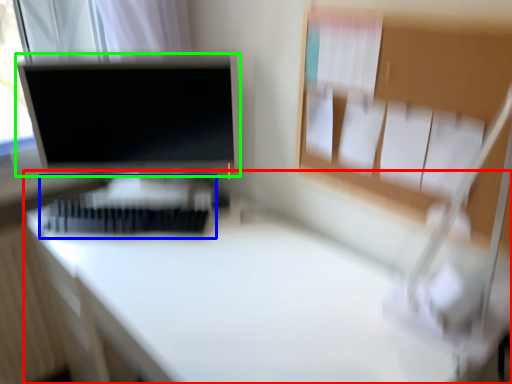
Question: Considering the real-world distances, which object is closest to desk (highlighted by a red box)? bed (highlighted by a blue box) or computer monitor (highlighted by a green box).

Choices:
 (A) bed
 (B) computer monitor

Answer: (A)